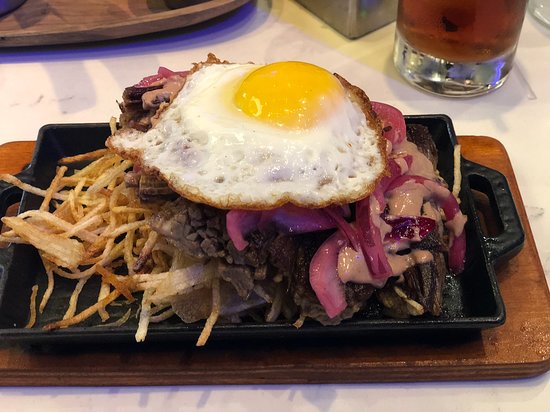
Identify the location of cutting board. This screenshot has height=412, width=550. (509, 353).